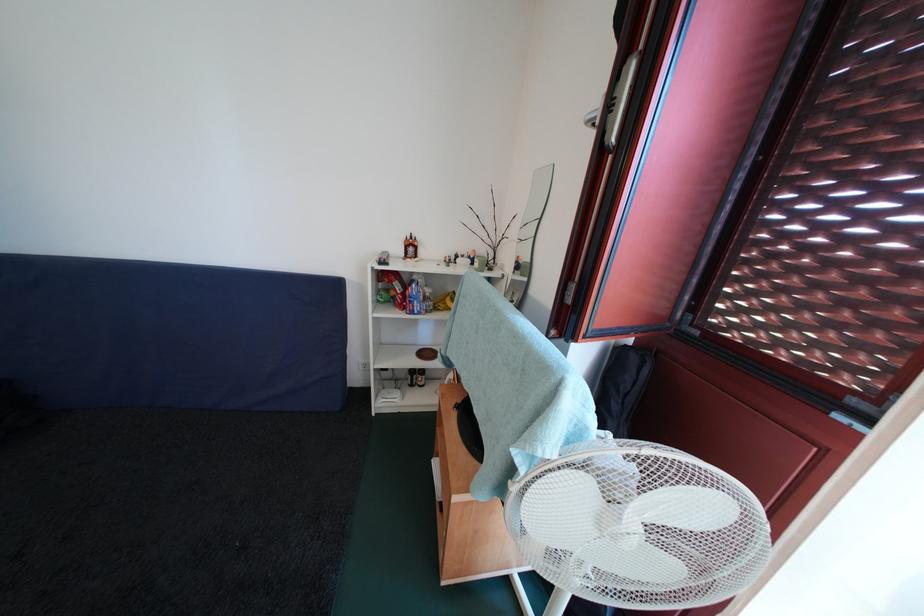
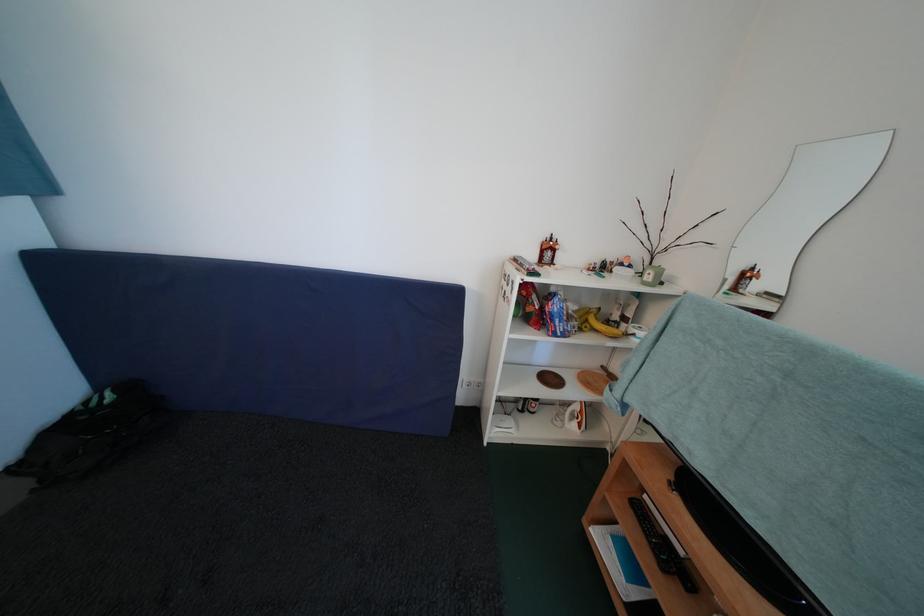
In the second image, find the point that corresponds to point (457, 381) in the first image.

(584, 411)